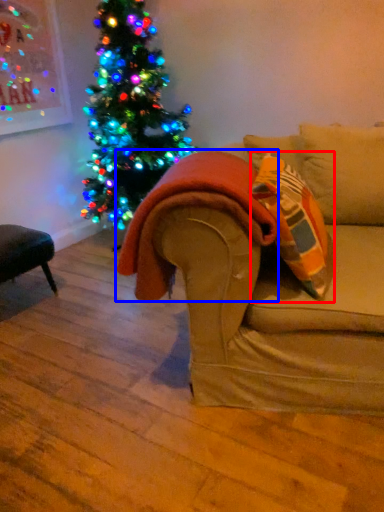
Question: Which of the following is the closest to the observer, throw pillow (highlighted by a red box) or blanket (highlighted by a blue box)?

Choices:
 (A) throw pillow
 (B) blanket

Answer: (A)